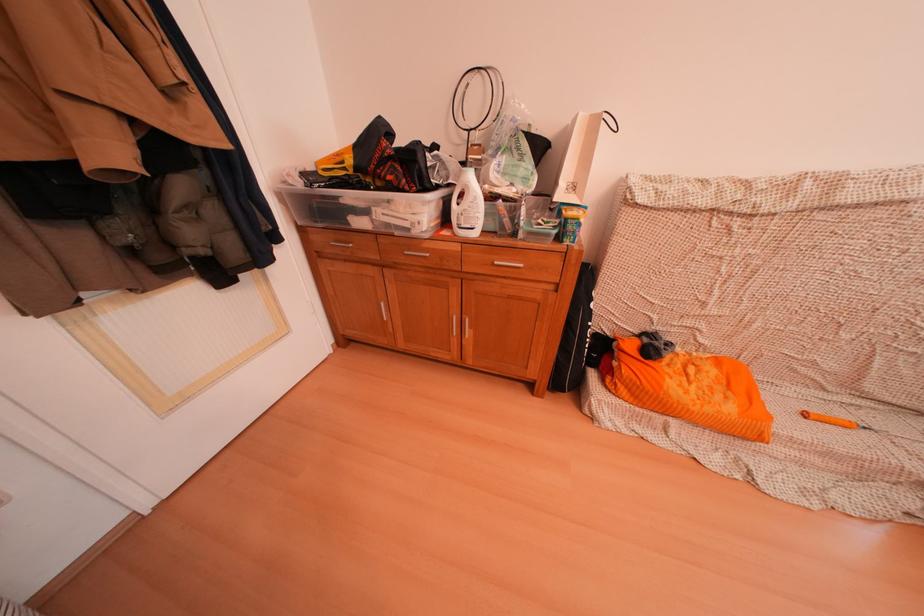
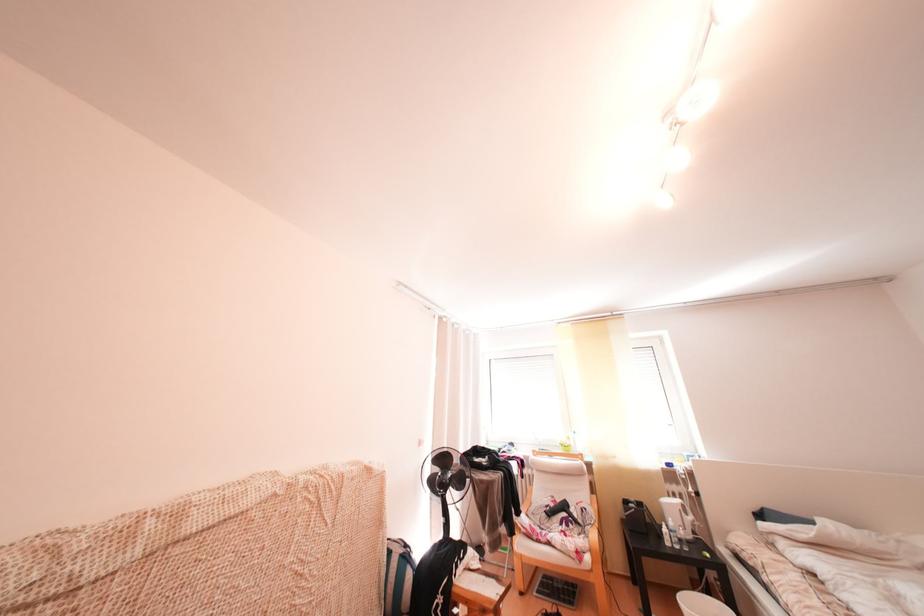
The images are taken continuously from a first-person perspective. In which direction is your viewpoint rotating?

The rotation direction of the camera is right-up.